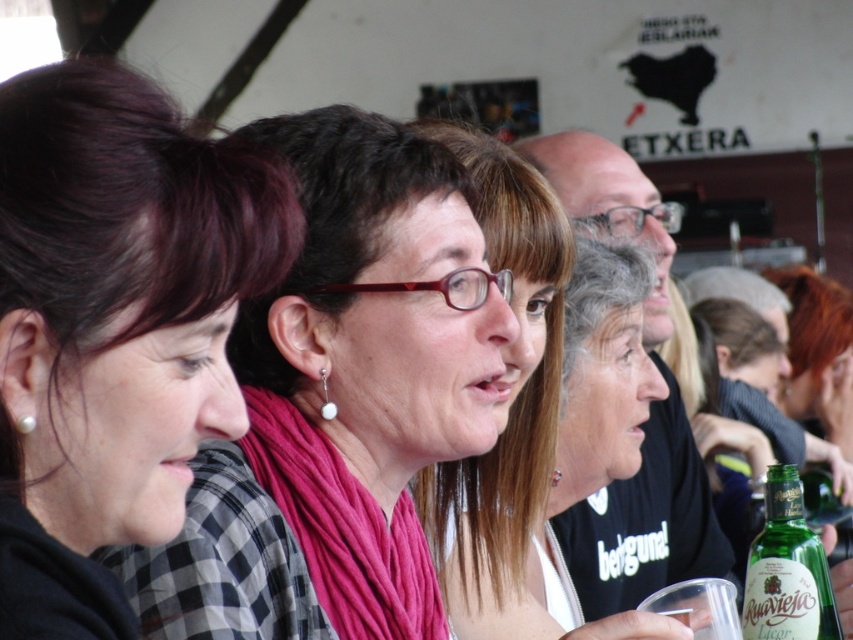
Who is lower down, pink fabric scarf at center or dark brown hair at left?

pink fabric scarf at center is lower down.

Between point (514, 326) and point (187, 244), which one is positioned in front?

Point (187, 244) is more forward.

Which is behind, point (283, 138) or point (175, 161)?

Positioned behind is point (283, 138).

Identify the location of pink fabric scarf at center. The image size is (853, 640). (339, 401).

Is dark brown hair at left shorter than matte pink scarf at center?

Indeed, dark brown hair at left has a lesser height compared to matte pink scarf at center.

Image resolution: width=853 pixels, height=640 pixels. What do you see at coordinates (113, 326) in the screenshot? I see `dark brown hair at left` at bounding box center [113, 326].

Image resolution: width=853 pixels, height=640 pixels. I want to click on dark brown hair at left, so click(x=113, y=326).

Is pink fabric scarf at center positioned behind green glass bottle at lower right?

Yes.

Who is higher up, pink fabric scarf at center or green glass bottle at lower right?

pink fabric scarf at center is above.

Who is more forward, (415, 257) or (839, 625)?

Point (839, 625)

The height and width of the screenshot is (640, 853). Find the location of `pink fabric scarf at center`. pink fabric scarf at center is located at coordinates (339, 401).